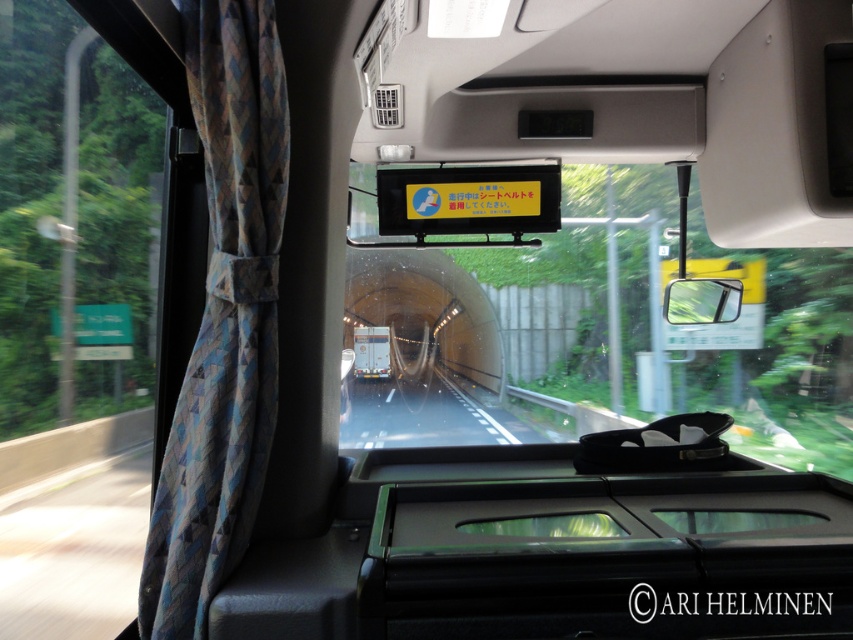
Question: Estimate the real-world distances between objects in this image. Which object is closer to the metallic silver phone at center?

Choices:
 (A) transparent glass windshield at center
 (B) transparent glass window at left

Answer: (A)

Question: Which point is farther to the camera?

Choices:
 (A) blue fabric curtain at left
 (B) transparent glass window at left
 (C) metallic silver phone at center
 (D) transparent glass windshield at center

Answer: (C)

Question: Is the position of transparent glass windshield at center more distant than that of blue fabric curtain at left?

Choices:
 (A) no
 (B) yes

Answer: (B)

Question: Can you confirm if transparent glass windshield at center is positioned to the right of transparent glass window at left?

Choices:
 (A) yes
 (B) no

Answer: (A)

Question: Which is nearer to the blue fabric curtain at left?

Choices:
 (A) metallic silver phone at center
 (B) transparent glass window at left

Answer: (B)

Question: Does transparent glass windshield at center have a larger size compared to transparent glass window at left?

Choices:
 (A) yes
 (B) no

Answer: (A)